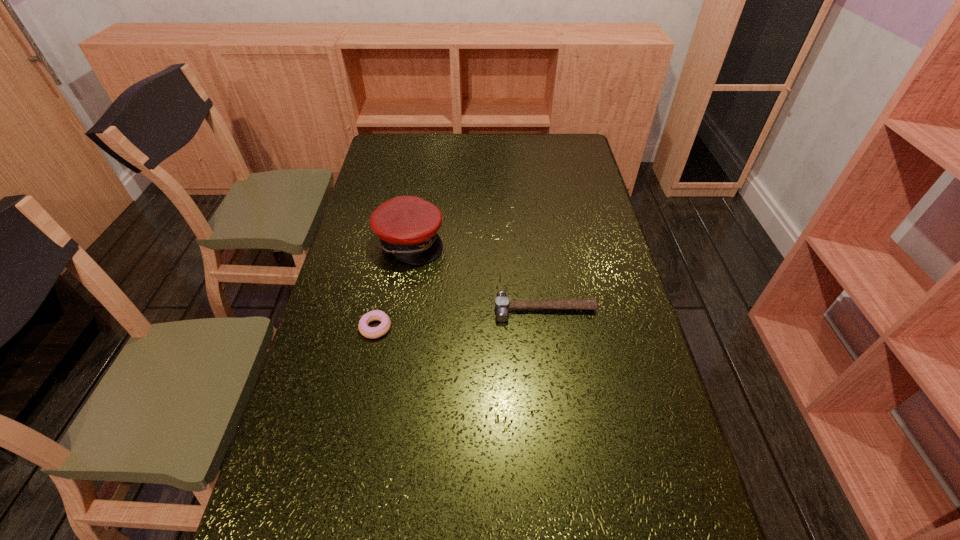
Identify which object is the closest to the tallest object. Please provide its 2D coordinates. Your answer should be formatted as a tuple, i.e. [(x, y)], where the tuple contains the x and y coordinates of a point satisfying the conditions above.

[(368, 332)]